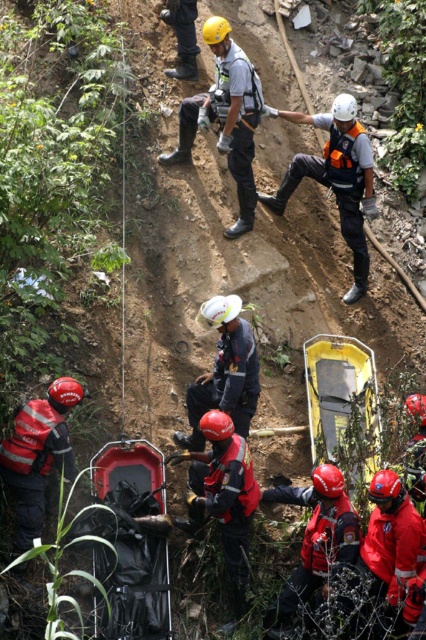
Question: Which object is positioned farthest from the black plastic stretcher at center?

Choices:
 (A) white hard hat at center
 (B) red matte helmet at lower left
 (C) white hard hat at upper center
 (D) white matte helmet at center

Answer: (C)

Question: Does black plastic stretcher at center have a larger size compared to white hard hat at upper center?

Choices:
 (A) yes
 (B) no

Answer: (B)

Question: Which object appears farthest from the camera in this image?

Choices:
 (A) white hard hat at upper center
 (B) white hard hat at center
 (C) white matte helmet at center

Answer: (A)

Question: Can you confirm if black plastic stretcher at center is positioned to the right of red matte helmet at lower left?

Choices:
 (A) no
 (B) yes

Answer: (B)

Question: Which object is closer to the camera taking this photo?

Choices:
 (A) black plastic stretcher at center
 (B) white hard hat at center

Answer: (A)

Question: Is white hard hat at upper center further to the viewer compared to red matte helmet at lower left?

Choices:
 (A) no
 (B) yes

Answer: (B)